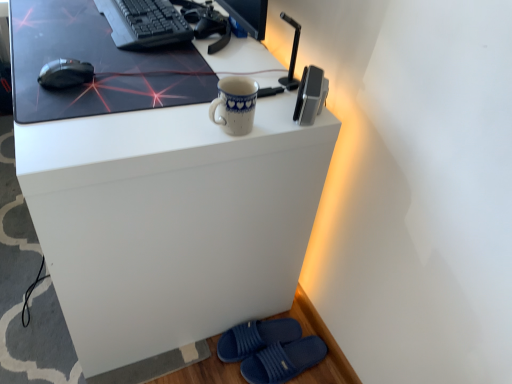
The height and width of the screenshot is (384, 512). Identify the location of vacant space that's between blue porcelain mug at upper center and matte black mousepad at upper center. (142, 122).